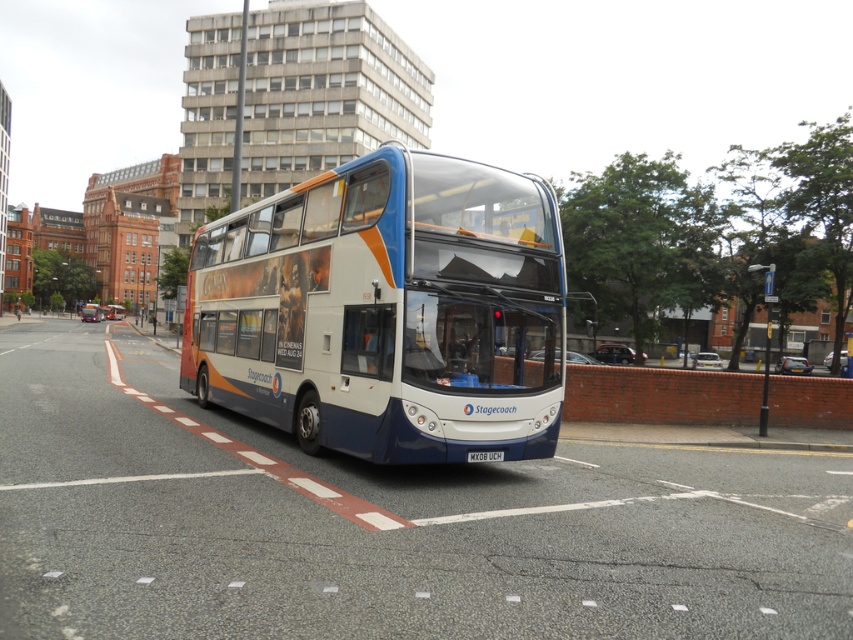
You are a pedestrian standing on the sidewalk. You see the white plastic license plate at center and the white glossy bus at center. How far apart are these two objects?

The distance between the white plastic license plate at center and the white glossy bus at center is 135.87 meters.

Looking at this image, you are a pedestrian standing on the sidewalk. You see a white glossy decker bus at center and a white glossy bus at center. Which one is closer to you?

The white glossy decker bus at center is closer to you than the white glossy bus at center according to the spatial description.

You are a city planner analyzing traffic flow. The bus lane is marked from point 0.4 to 0.5 along the road. Based on the bus position, can the white glossy decker bus at center legally drive in the bus lane?

The white glossy decker bus at center is positioned at point 0.454, which falls within the bus lane marked from 0.4 to 0.5. Therefore, it can legally drive in the bus lane.